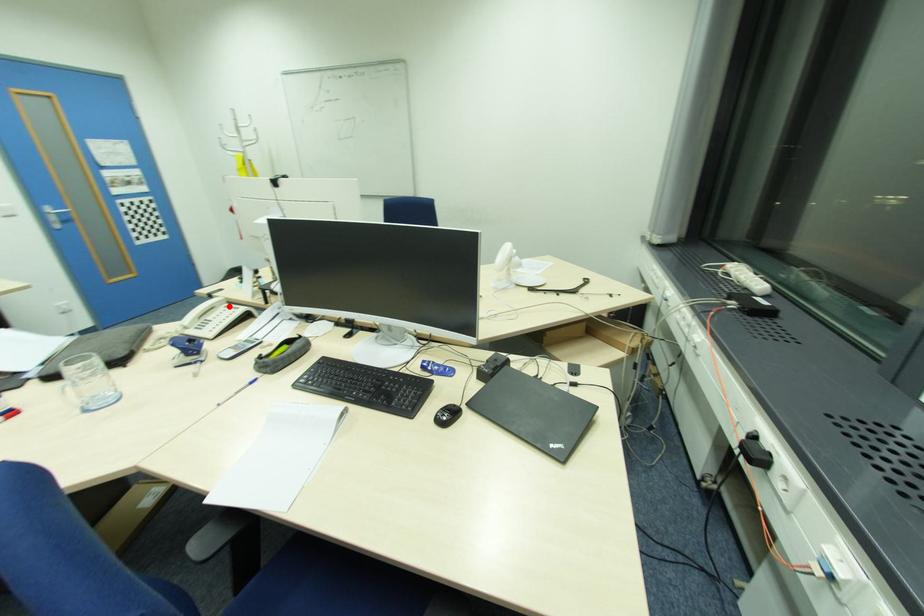
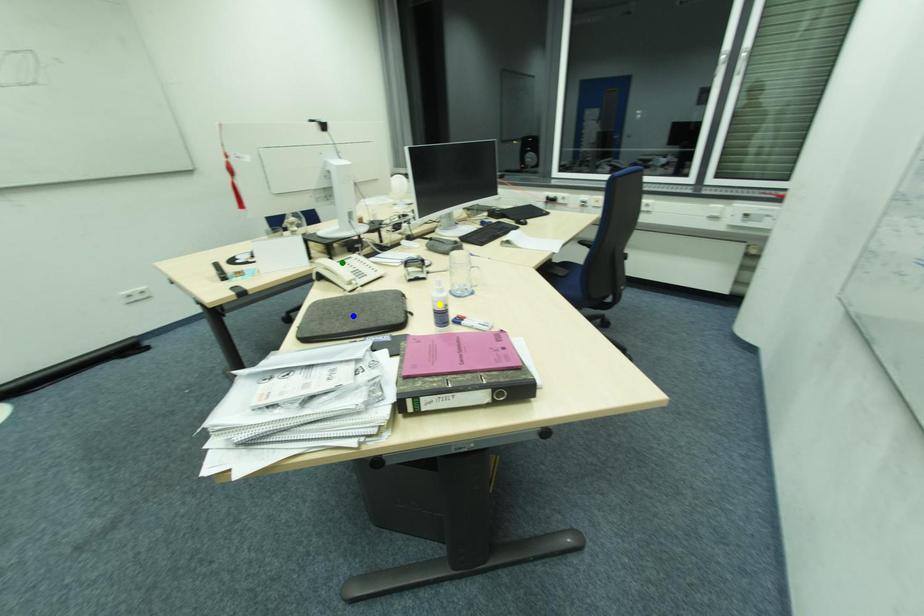
Question: I am providing you with two images of the same scene from different viewpoints. A red point is marked on the first image. You are given multiple points on the second image. In image 2, which mark is for the same physical point as the one in image 1?

Choices:
 (A) yellow point
 (B) blue point
 (C) green point

Answer: (C)